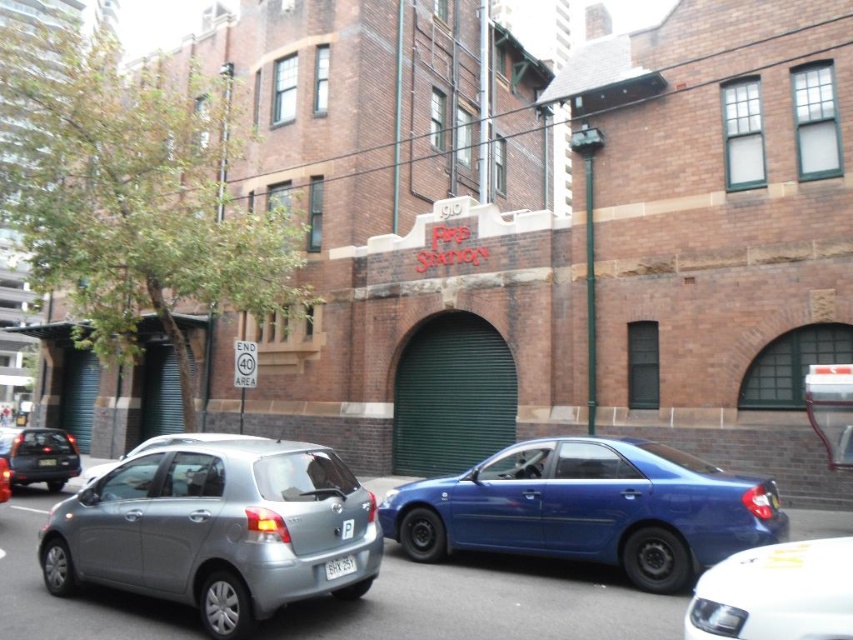
Question: Does satin silver hatchback at lower left appear under white plastic license plate at lower center?

Choices:
 (A) no
 (B) yes

Answer: (A)

Question: Which point is farther to the camera?

Choices:
 (A) (178, 580)
 (B) (41, 458)
 (C) (811, 570)

Answer: (B)

Question: Can you confirm if satin silver hatchback at lower left is positioned below white plastic license plate at center?

Choices:
 (A) no
 (B) yes

Answer: (A)

Question: Which is nearer to the white plastic license plate at center?

Choices:
 (A) white glossy sedan at center
 (B) glossy blue sedan at center
 (C) white plastic license plate at lower center

Answer: (C)

Question: Which object is the closest to the glossy blue sedan at center?

Choices:
 (A) matte black sedan at left
 (B) white glossy sedan at center

Answer: (B)

Question: Can you confirm if white plastic license plate at lower center is positioned above matte silver hatchback at center?

Choices:
 (A) yes
 (B) no

Answer: (A)